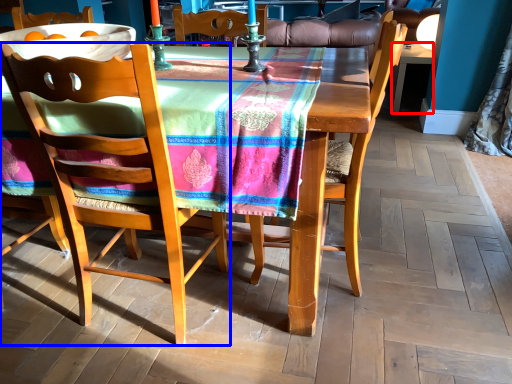
Question: Which point is further to the camera, desk (highlighted by a red box) or chair (highlighted by a blue box)?

Choices:
 (A) desk
 (B) chair

Answer: (A)